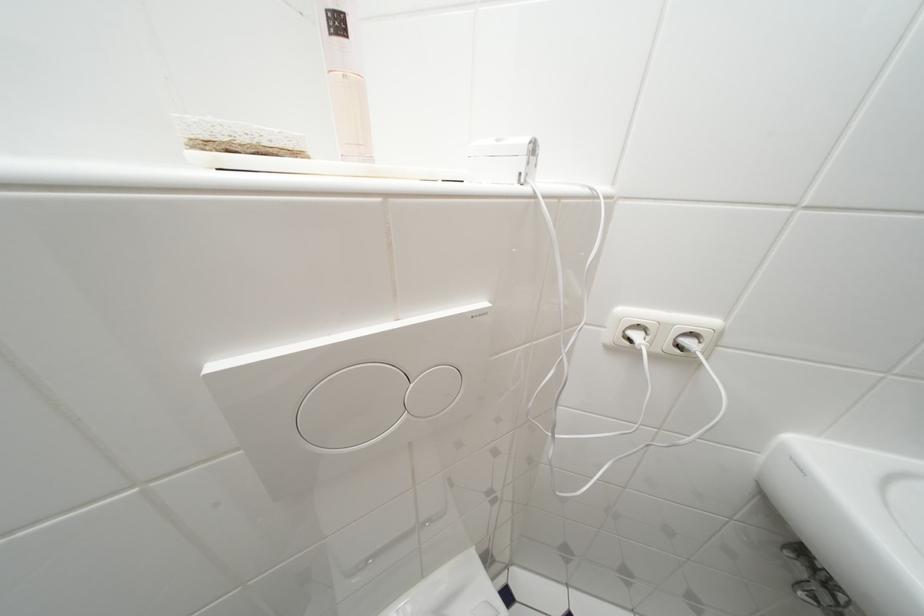
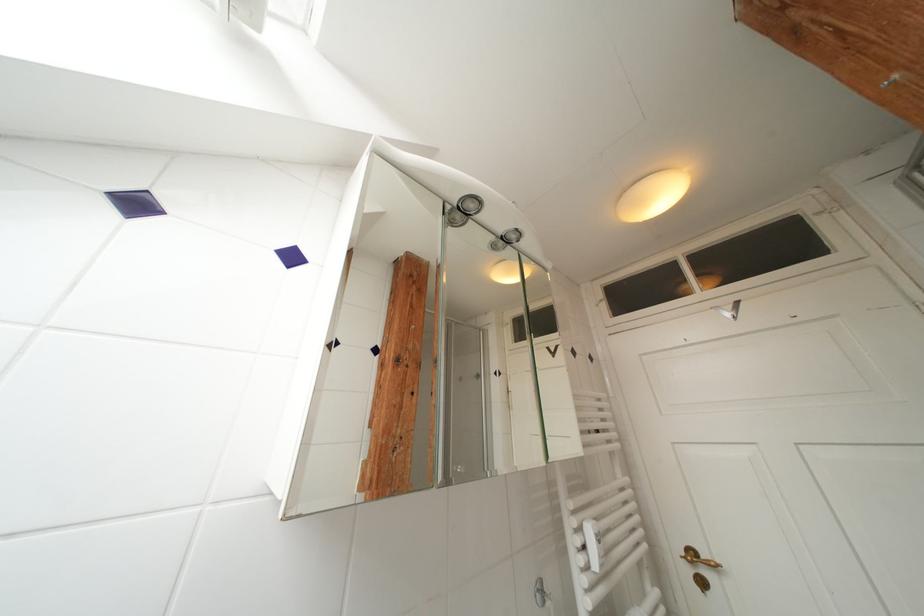
First-person continuous shooting, in which direction is the camera rotating?

The camera's rotation is toward right-up.